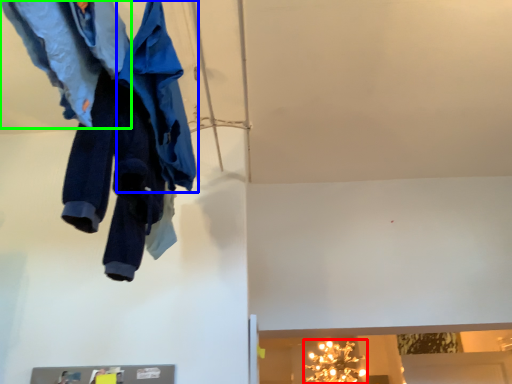
Question: Which object is the farthest from light fixture (highlighted by a red box)? Choose among these: cloak (highlighted by a blue box) or trousers (highlighted by a green box).

Choices:
 (A) cloak
 (B) trousers

Answer: (B)